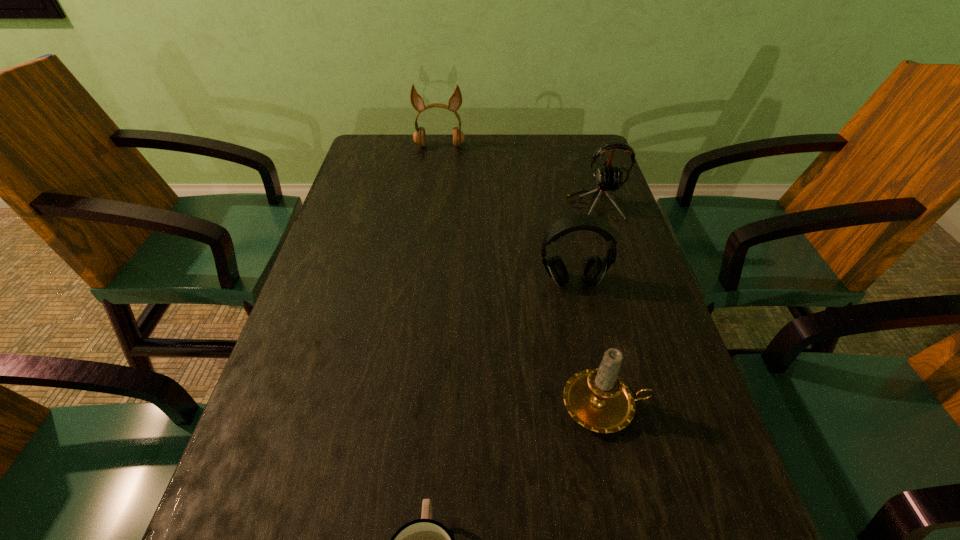
In order to click on the leftmost earphone in this screenshot , I will do `click(455, 101)`.

Image resolution: width=960 pixels, height=540 pixels. What are the coordinates of `the farthest earphone` in the screenshot? It's located at (455, 101).

At what (x,y) coordinates should I click in order to perform the action: click on the second farthest object. Please return your answer as a coordinate pair (x, y). The width and height of the screenshot is (960, 540). Looking at the image, I should click on (608, 179).

Find the location of a particular element. This screenshot has width=960, height=540. the nearest earphone is located at coordinates (594, 268).

Where is `candle`? Image resolution: width=960 pixels, height=540 pixels. candle is located at coordinates (597, 399).

Image resolution: width=960 pixels, height=540 pixels. In order to click on vacant space located on the front-facing side of the farthest earphone in this screenshot , I will do `click(437, 172)`.

Locate an element on the screen. The height and width of the screenshot is (540, 960). free location located on the back of the second farthest object is located at coordinates (573, 136).

Where is `free space located on the ear cups of the third nearest object`? The width and height of the screenshot is (960, 540). free space located on the ear cups of the third nearest object is located at coordinates (579, 319).

Where is `blank area located on the left of the candle`? blank area located on the left of the candle is located at coordinates (337, 405).

Where is `object that is positioned at the far edge`? The height and width of the screenshot is (540, 960). object that is positioned at the far edge is located at coordinates (455, 101).